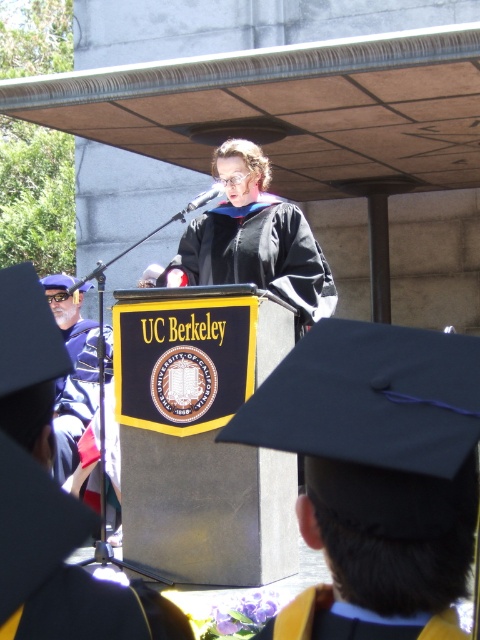
Who is lower down, matte black graduation gown at center or yellow matte graduation gown at lower center?

yellow matte graduation gown at lower center

Who is more distant from viewer, (294, 262) or (308, 593)?

The point (294, 262) is behind.

Measure the distance between point [227,260] and camera.

Point [227,260] and camera are 6.00 meters apart.

In order to click on matte black graduation gown at center in this screenshot , I will do `click(257, 256)`.

Consider the image. Who is shorter, matte black graduation gown at left or yellow matte graduation gown at lower center?

yellow matte graduation gown at lower center is shorter.

Is matte black graduation gown at left bigger than yellow matte graduation gown at lower center?

Correct, matte black graduation gown at left is larger in size than yellow matte graduation gown at lower center.

What are the coordinates of `matte black graduation gown at left` in the screenshot? It's located at (72, 371).

From the picture: Between matte black graduation gown at center and matte black graduation gown at left, which one has more height?

matte black graduation gown at left

Measure the distance between matte black graduation gown at center and matte black graduation gown at left.

They are 2.33 meters apart.

The height and width of the screenshot is (640, 480). In order to click on matte black graduation gown at center in this screenshot , I will do `click(257, 256)`.